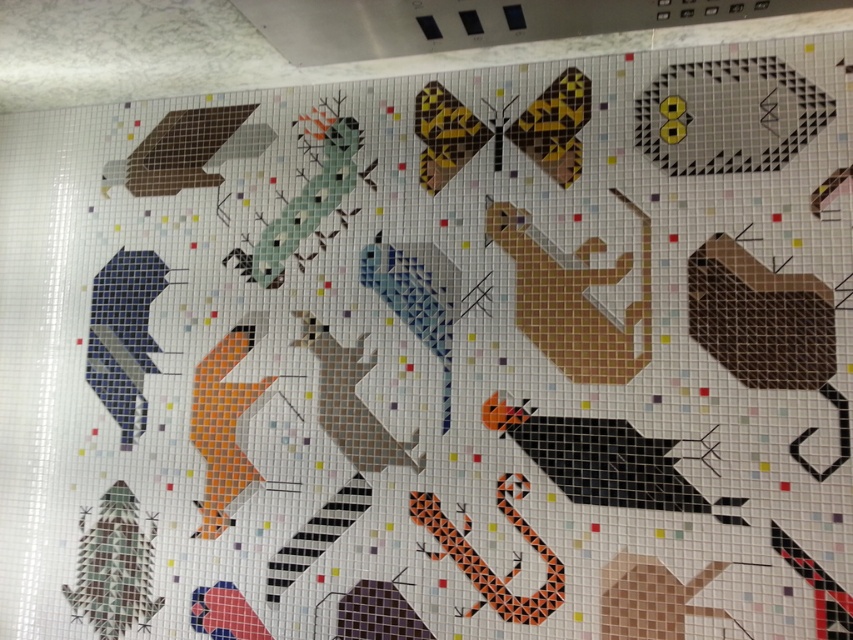
You are standing 5 feet away from the artwork. Can you comfortably view the matte beige bird at center without moving closer?

The matte beige bird at center is 4.89 feet away from the viewer. Since you are standing 5 feet away, you are slightly farther than the bird, so you can comfortably view it without needing to move closer.

You are an art critic analyzing the mosaic artwork. You notice the yellow dotted square at upper right and the matte beige bird at center. Which object appears to be nearer to you in the artwork?

The yellow dotted square at upper right is closer to the viewer than the matte beige bird at center, so it appears nearer in the artwork.